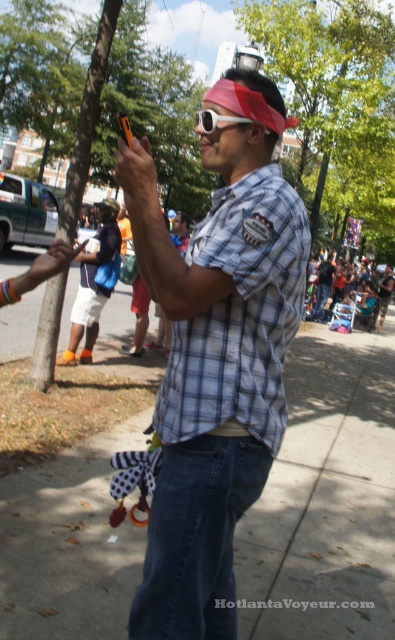
Question: Which point is farther to the camera?

Choices:
 (A) smooth concrete sidewalk at center
 (B) matte orange pen at upper left

Answer: (A)

Question: Which object is positioned farthest from the matte orange pen at upper left?

Choices:
 (A) smooth concrete sidewalk at center
 (B) gray checkered shirt at center
 (C) plaid shirt at center

Answer: (A)

Question: Can you confirm if smooth concrete sidewalk at center is positioned above matte black phone at center?

Choices:
 (A) no
 (B) yes

Answer: (A)

Question: Does smooth concrete sidewalk at center appear on the left side of matte orange pen at upper left?

Choices:
 (A) yes
 (B) no

Answer: (A)

Question: Observing the image, what is the correct spatial positioning of gray checkered shirt at center in reference to matte orange pen at upper left?

Choices:
 (A) right
 (B) left

Answer: (A)

Question: Which point appears closest to the camera in this image?

Choices:
 (A) (148, 189)
 (B) (381, 428)
 (C) (223, 422)

Answer: (A)